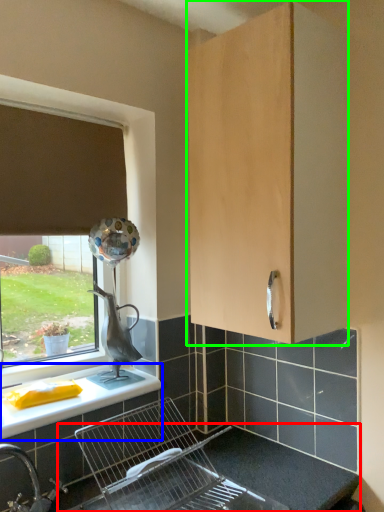
Question: Based on their relative distances, which object is nearer to counter top (highlighted by a red box)? Choose from countertop (highlighted by a blue box) and cabinetry (highlighted by a green box).

Choices:
 (A) countertop
 (B) cabinetry

Answer: (A)